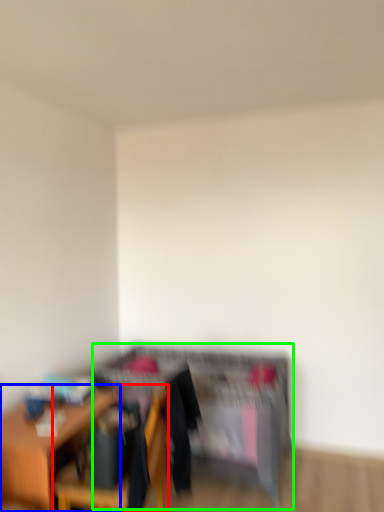
Question: Which object is positioned farthest from chair (highlighted by a red box)? Select from table (highlighted by a blue box) and dresser (highlighted by a green box).

Choices:
 (A) table
 (B) dresser

Answer: (B)